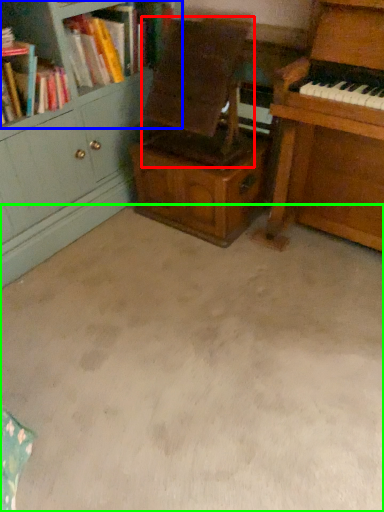
Question: Based on their relative distances, which object is farther from armchair (highlighted by a red box)? Choose from bookcase (highlighted by a blue box) and plain (highlighted by a green box).

Choices:
 (A) bookcase
 (B) plain

Answer: (B)